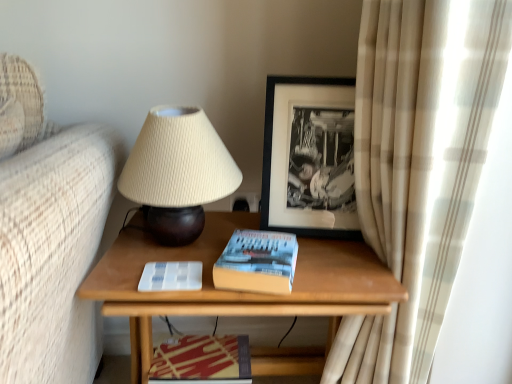
The width and height of the screenshot is (512, 384). Identify the location of vacant space to the right of hardcover book at center. (343, 266).